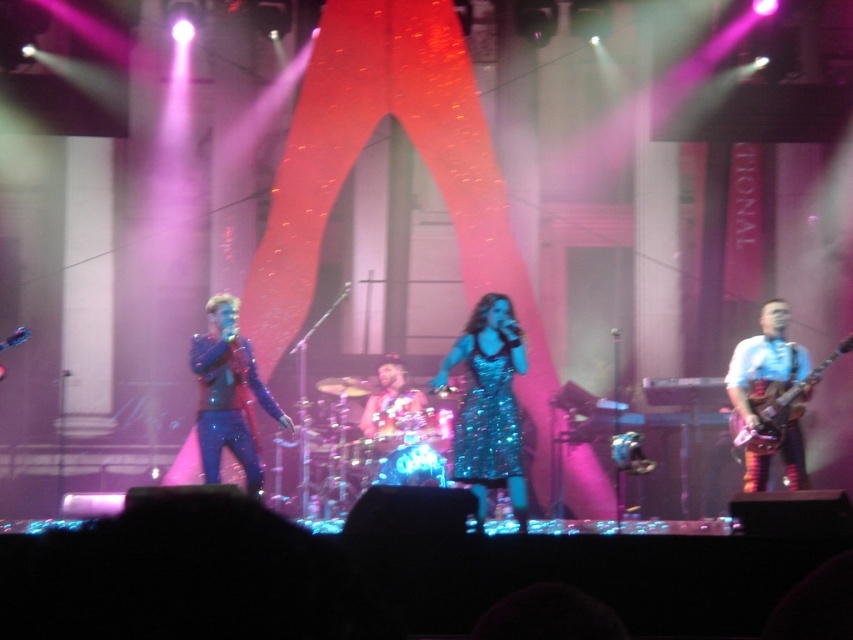
You are a photographer at the back of the venue. You want to capture a photo that includes both the sparkly blue jacket at center and the shiny metallic drum set at center. Based on their sizes, which object will appear larger in the photo?

The sparkly blue jacket at center will appear larger in the photo because it is bigger than the shiny metallic drum set at center.

You are a photographer in the audience taking pictures of the sparkly blue jacket at center and the shiny metallic drum set at center. Which object is closer to your camera lens?

The sparkly blue jacket at center is closer to the camera lens because it is in front of the shiny metallic drum set at center.

You are a photographer positioned at the camera. You want to capture a closeup shot of the sparkly teal dress at center. Given that the minimum focusing distance of your camera is 5 meters, can you achieve this without moving closer?

The sparkly teal dress at center is 6.09 meters away from camera, which is beyond the minimum focusing distance of 5 meters. Therefore, you can achieve the closeup shot without moving closer.